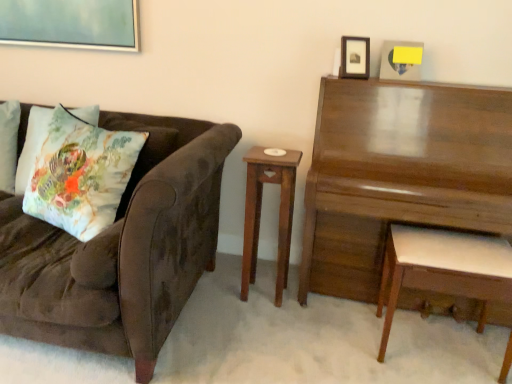
Question: Is there a large distance between wooden nightstand at center and floral fabric pillow at left?

Choices:
 (A) yes
 (B) no

Answer: (A)

Question: Can you confirm if wooden nightstand at center is positioned to the left of floral fabric pillow at left?

Choices:
 (A) no
 (B) yes

Answer: (A)

Question: Is wooden nightstand at center behind floral fabric pillow at left?

Choices:
 (A) yes
 (B) no

Answer: (B)

Question: From the image's perspective, is wooden nightstand at center on floral fabric pillow at left?

Choices:
 (A) no
 (B) yes

Answer: (A)

Question: Is wooden nightstand at center taller than floral fabric pillow at left?

Choices:
 (A) yes
 (B) no

Answer: (A)

Question: From their relative heights in the image, would you say glossy wood piano at upper right is taller or shorter than wooden picture frame at upper right, marked as the first picture frame in a left-to-right arrangement?

Choices:
 (A) tall
 (B) short

Answer: (A)

Question: Visually, is glossy wood piano at upper right positioned to the left or to the right of wooden picture frame at upper right, marked as the first picture frame in a left-to-right arrangement?

Choices:
 (A) left
 (B) right

Answer: (B)

Question: Looking at their shapes, would you say glossy wood piano at upper right is wider or thinner than wooden picture frame at upper right, marked as the first picture frame in a left-to-right arrangement?

Choices:
 (A) thin
 (B) wide

Answer: (B)

Question: From a real-world perspective, relative to wooden picture frame at upper right, marked as the 2th picture frame in a right-to-left arrangement, is glossy wood piano at upper right vertically above or below?

Choices:
 (A) below
 (B) above

Answer: (A)

Question: Is wooden picture frame at upper right, acting as the 1th picture frame starting from the right, inside or outside of floral cotton cushion at left?

Choices:
 (A) outside
 (B) inside

Answer: (A)

Question: Considering their positions, is wooden picture frame at upper right, acting as the 1th picture frame starting from the right, located in front of or behind floral cotton cushion at left?

Choices:
 (A) behind
 (B) front

Answer: (A)

Question: Is wooden picture frame at upper right, acting as the 1th picture frame starting from the right, taller or shorter than floral cotton cushion at left?

Choices:
 (A) tall
 (B) short

Answer: (B)

Question: Based on their sizes in the image, would you say wooden picture frame at upper right, acting as the 1th picture frame starting from the right, is bigger or smaller than floral cotton cushion at left?

Choices:
 (A) small
 (B) big

Answer: (A)

Question: From a real-world perspective, is wooden picture frame at upper right, marked as the first picture frame in a left-to-right arrangement, above or below velvet brown couch at left?

Choices:
 (A) below
 (B) above

Answer: (B)

Question: In terms of width, does wooden picture frame at upper right, marked as the first picture frame in a left-to-right arrangement, look wider or thinner when compared to velvet brown couch at left?

Choices:
 (A) wide
 (B) thin

Answer: (B)